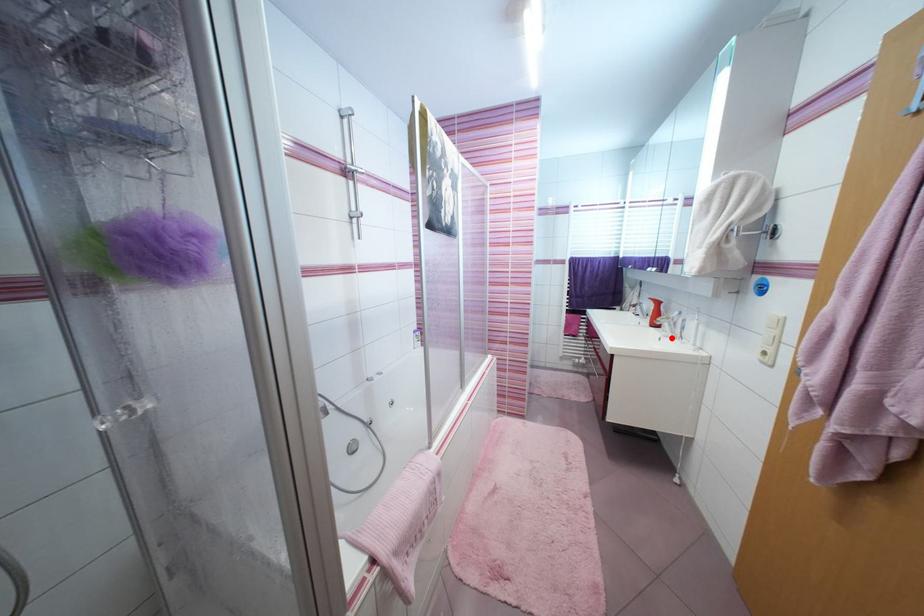
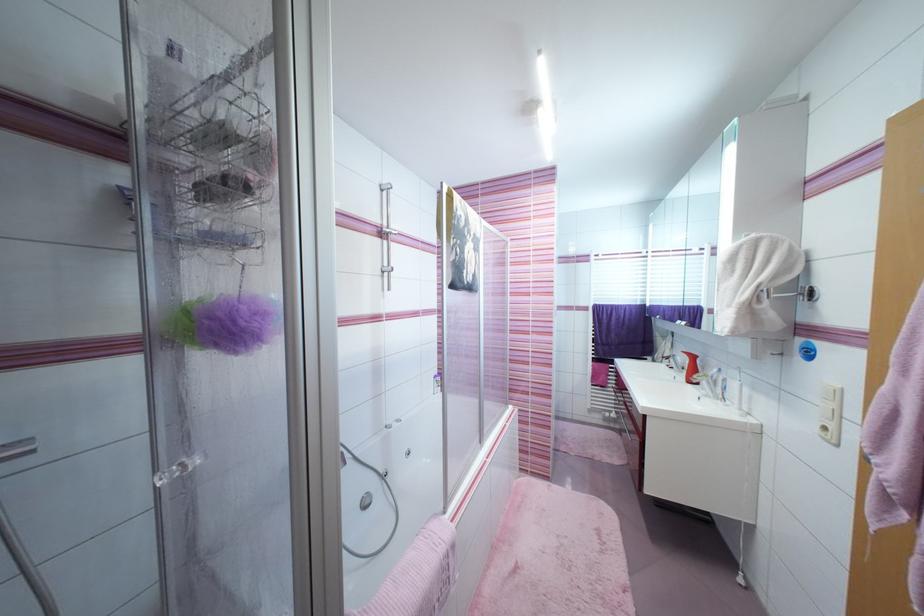
The point at the highlighted location is marked in the first image. Where is the corresponding point in the second image?

(711, 398)